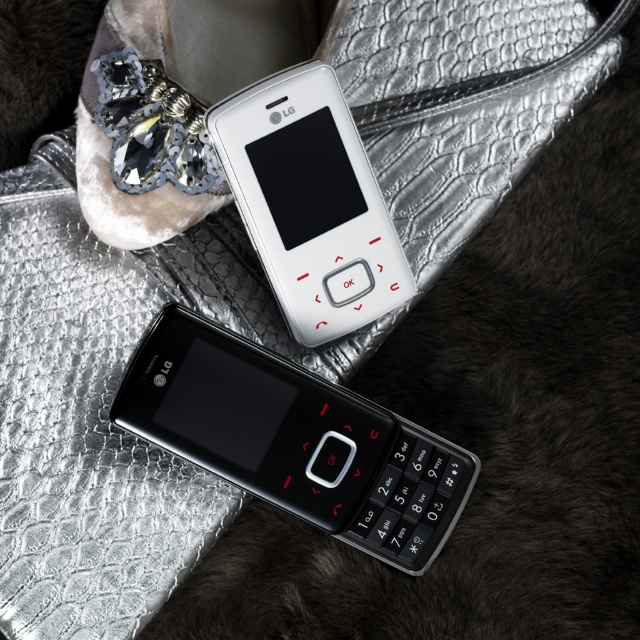
Question: Can you confirm if black fuzzy fur at lower right is positioned above white matte phone at center?

Choices:
 (A) yes
 (B) no

Answer: (B)

Question: Is black fuzzy fur at lower right further to the viewer compared to white matte phone at center?

Choices:
 (A) no
 (B) yes

Answer: (B)

Question: Is black matte phone at center further to the viewer compared to white matte phone at center?

Choices:
 (A) yes
 (B) no

Answer: (A)

Question: Which object is farther from the camera taking this photo?

Choices:
 (A) black fuzzy fur at lower right
 (B) white matte phone at center

Answer: (A)

Question: Among these objects, which one is nearest to the camera?

Choices:
 (A) white matte phone at center
 (B) black fuzzy fur at lower right
 (C) black matte phone at center

Answer: (A)

Question: Which point appears farthest from the camera in this image?

Choices:
 (A) (632, 241)
 (B) (368, 204)
 (C) (291, 413)

Answer: (A)